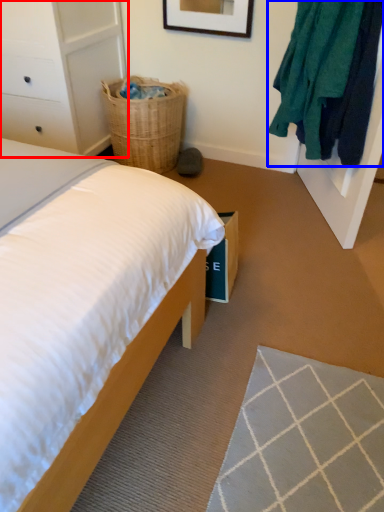
Question: Among these objects, which one is farthest to the camera, dresser (highlighted by a red box) or clothing (highlighted by a blue box)?

Choices:
 (A) dresser
 (B) clothing

Answer: (A)